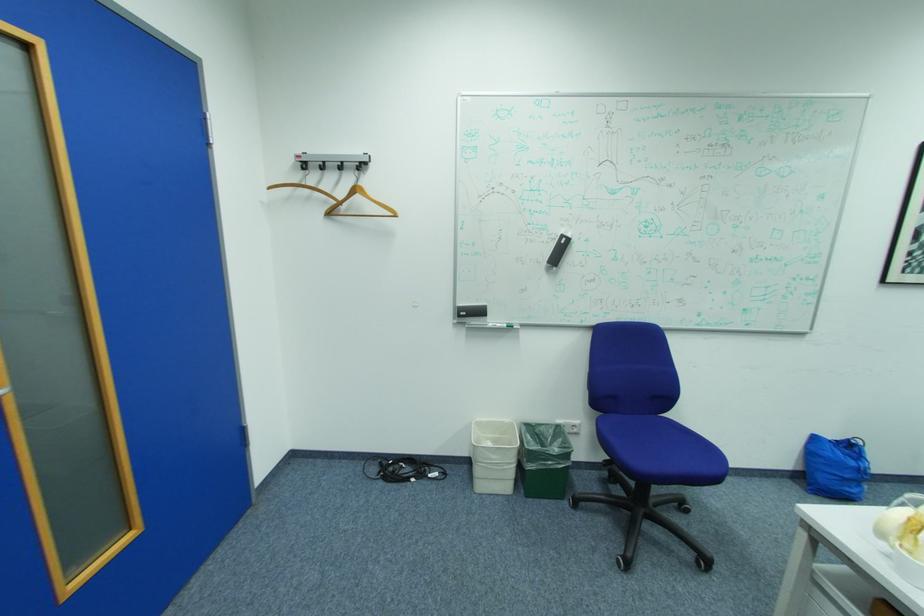
Find the location of a particular element. white bowl is located at coordinates tap(908, 565).